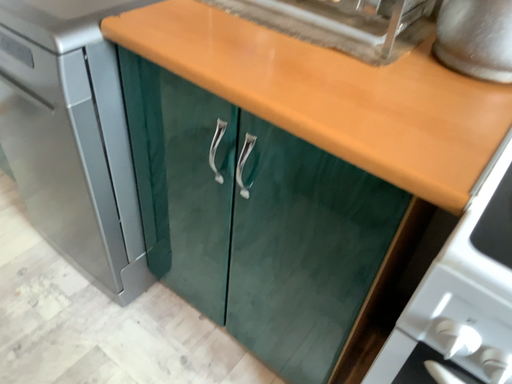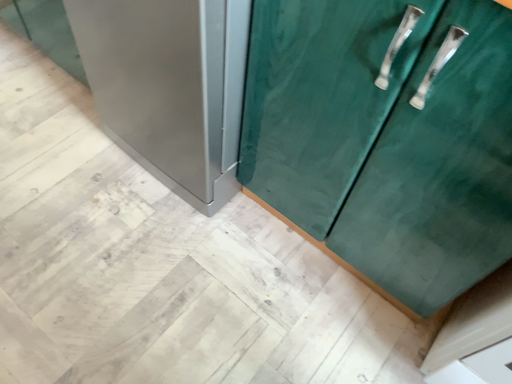
Question: How did the camera likely rotate when shooting the video?

Choices:
 (A) rotated upward
 (B) rotated downward

Answer: (B)